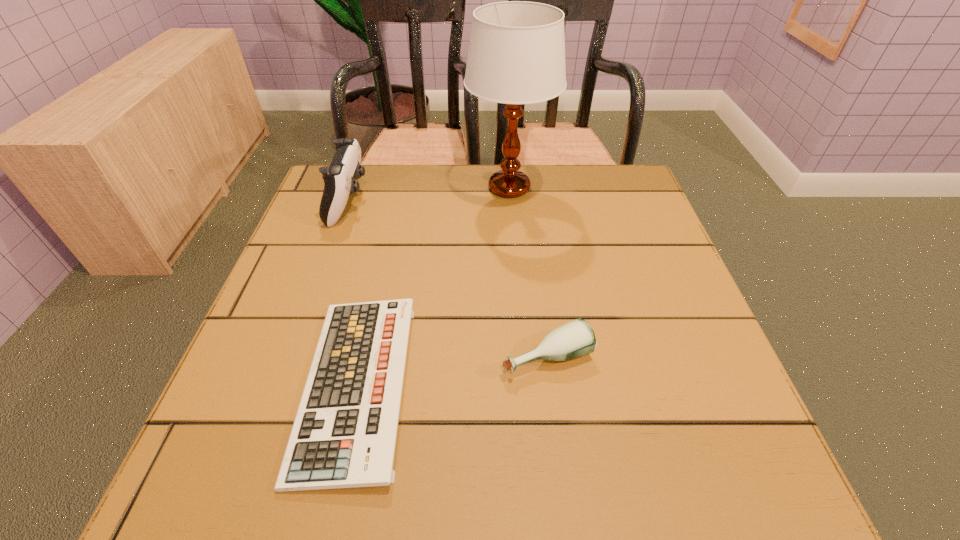
The image size is (960, 540). What are the coordinates of `object located at the near edge` in the screenshot? It's located at (344, 435).

Identify the location of control that is at the left edge. (339, 178).

What are the coordinates of `computer keyboard located at the left edge` in the screenshot? It's located at (344, 435).

You are a GUI agent. You are given a task and a screenshot of the screen. Output one action in this format:
    pyautogui.click(x=<x>, y=<y>)
    Task: Click on the object present at the far left corner
    
    Given the screenshot: What is the action you would take?
    pyautogui.click(x=339, y=178)

The height and width of the screenshot is (540, 960). I want to click on object that is at the near left corner, so click(x=344, y=435).

Locate an element on the screen. vacant area at the far edge of the desktop is located at coordinates (466, 171).

Identify the location of vacant space at the near edge. (492, 447).

Where is `free space at the left edge of the desktop`? The width and height of the screenshot is (960, 540). free space at the left edge of the desktop is located at coordinates (324, 255).

Where is `vacant space at the right edge of the desktop`? vacant space at the right edge of the desktop is located at coordinates point(685,312).

At what (x,y) coordinates should I click in order to perform the action: click on vacant space at the far left corner of the desktop. Please return your answer as a coordinate pair (x, y). Image resolution: width=960 pixels, height=540 pixels. Looking at the image, I should click on (373, 184).